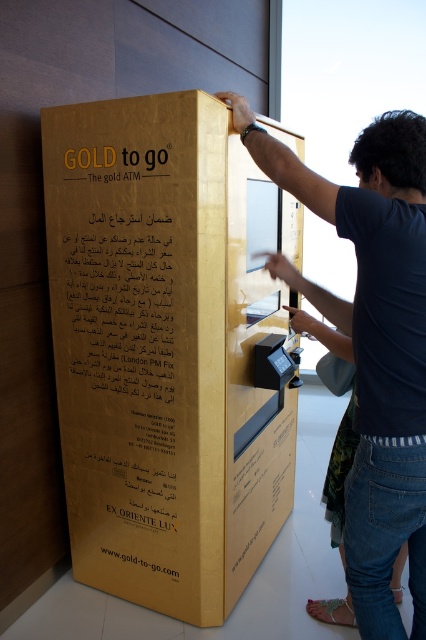
You are a customer standing in front of the gold metallic atm at center. You want to reach the point where you can see the website URL displayed on the machine. Is the point where you are currently standing, point (167,349), the correct location to view the website URL?

The point (167,349) is where the gold metallic atm at center is located. Since the website URL is displayed on the machine itself, you should be able to view it from your current position at point (167,349).

You are a customer standing in front of the gold metallic atm at center and dark blue shirt at center. You want to know which object is taller. What do you observe?

The gold metallic atm at center is taller than dark blue shirt at center.

Where is the gold metallic atm at center located in the image?

The gold metallic atm at center is located at the point with coordinates 0.547 in the x axis and 0.394 in the y axis.